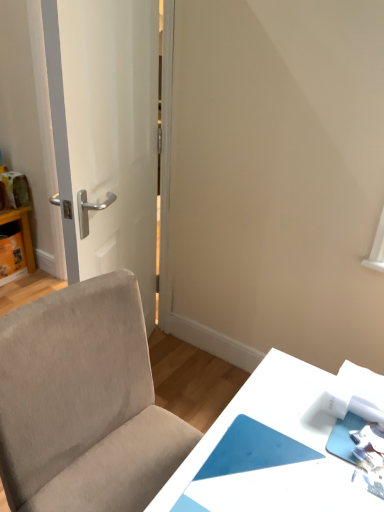
Question: From a real-world perspective, is white glossy table at lower right, which is counted as the 2th table, starting from the back, located higher than matte cardboard box at left, the first table positioned from the top?

Choices:
 (A) yes
 (B) no

Answer: (A)

Question: From the image's perspective, is white glossy table at lower right, acting as the first table starting from the right, on matte cardboard box at left, which is the second table from right to left?

Choices:
 (A) yes
 (B) no

Answer: (B)

Question: Is matte cardboard box at left, the first table positioned from the top, completely or partially inside white glossy table at lower right, which is counted as the 2th table, starting from the back?

Choices:
 (A) yes
 (B) no

Answer: (B)

Question: Is white glossy table at lower right, which is counted as the 1th table, starting from the front, to the right of matte cardboard box at left, the first table positioned from the top, from the viewer's perspective?

Choices:
 (A) no
 (B) yes

Answer: (B)

Question: Is white glossy table at lower right, acting as the first table starting from the right, completely or partially outside of matte cardboard box at left, the 2th table from the bottom?

Choices:
 (A) yes
 (B) no

Answer: (A)

Question: Considering the relative positions of white glossy table at lower right, which is the 2th table in top-to-bottom order, and matte cardboard box at left, the first table positioned from the top, in the image provided, is white glossy table at lower right, which is the 2th table in top-to-bottom order, behind matte cardboard box at left, the first table positioned from the top,?

Choices:
 (A) yes
 (B) no

Answer: (B)

Question: Would you say white glossy door at left is part of beige fabric chair at lower left's contents?

Choices:
 (A) no
 (B) yes

Answer: (A)

Question: Is beige fabric chair at lower left smaller than white glossy door at left?

Choices:
 (A) yes
 (B) no

Answer: (B)

Question: Is beige fabric chair at lower left facing towards white glossy door at left?

Choices:
 (A) no
 (B) yes

Answer: (A)

Question: Can you confirm if beige fabric chair at lower left is positioned to the left of white glossy door at left?

Choices:
 (A) no
 (B) yes

Answer: (A)

Question: Considering the relative sizes of beige fabric chair at lower left and white glossy door at left in the image provided, is beige fabric chair at lower left taller than white glossy door at left?

Choices:
 (A) no
 (B) yes

Answer: (A)

Question: Can you confirm if beige fabric chair at lower left is positioned to the right of white glossy door at left?

Choices:
 (A) yes
 (B) no

Answer: (A)

Question: From the image's perspective, is beige fabric chair at lower left beneath matte cardboard box at left, the first table positioned from the top?

Choices:
 (A) no
 (B) yes

Answer: (B)